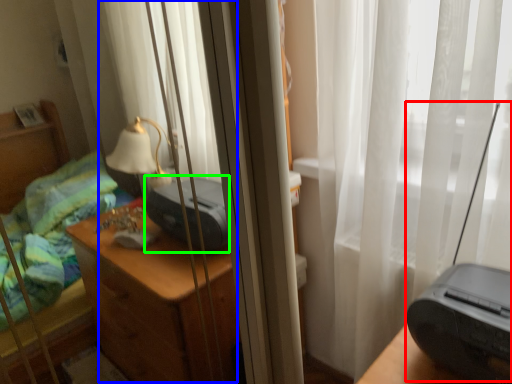
Question: Which is nearer to the equipment (highlighted by a red box)? curtain (highlighted by a blue box) or printer (highlighted by a green box).

Choices:
 (A) curtain
 (B) printer

Answer: (B)